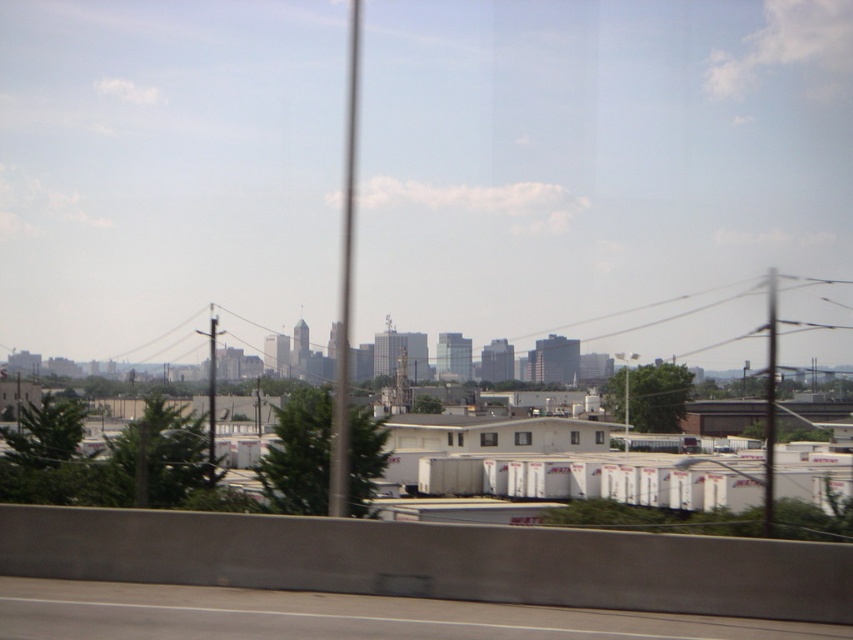
Is point (627, 628) farther from viewer compared to point (770, 376)?

No.

Does gray asphalt highway at lower center appear under metallic pole at right?

Yes.

This screenshot has width=853, height=640. Identify the location of gray asphalt highway at lower center. (338, 616).

Does metallic pole at center appear on the right side of metallic pole at right?

In fact, metallic pole at center is to the left of metallic pole at right.

Can you confirm if metallic pole at center is positioned above metallic pole at right?

A: Yes, metallic pole at center is above metallic pole at right.

Is point (337, 432) closer to viewer compared to point (766, 531)?

That is True.

In order to click on metallic pole at center in this screenshot , I will do `click(345, 289)`.

Which is behind, point (119, 630) or point (344, 392)?

Positioned behind is point (344, 392).

Does gray asphalt highway at lower center appear on the left side of metallic pole at center?

Incorrect, gray asphalt highway at lower center is not on the left side of metallic pole at center.

Who is more distant from viewer, (334, 598) or (351, 100)?

Point (351, 100)

The image size is (853, 640). Find the location of `gray asphalt highway at lower center`. gray asphalt highway at lower center is located at coordinates (338, 616).